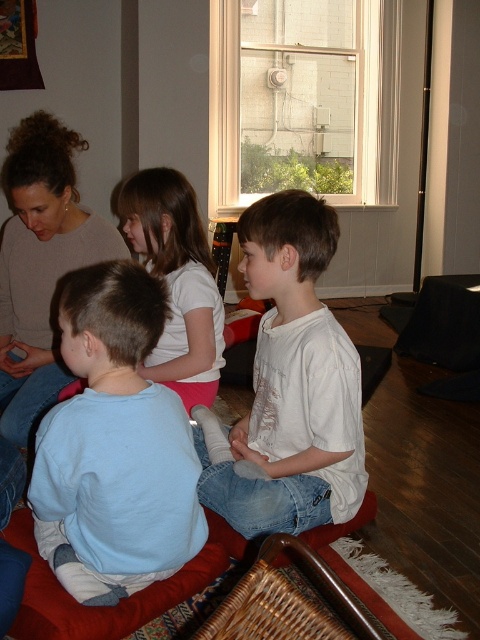
In the scene shown: You are a parent trying to ensure all children are within a safe distance of each other for a group activity. The children are positioned at point (204, 529). What is the minimum distance you should set for the safety zone to include all children?

The minimum distance for the safety zone should be at least 1.64 meters to include all children positioned at point (204, 529).

You are a photographer trying to capture a group photo of the children. You notice two children wearing white shirts at the center of the scene. To ensure both are visible, should you position the child in the white cotton shirt at center to the right or left of the white matte shirt at center?

The white cotton shirt at center is already positioned to the right of the white matte shirt at center, so you should keep the white cotton shirt at center to the right of the white matte shirt at center to ensure both are visible.

You are a photographer trying to capture a clear shot of both the white cotton shirt at center and the white matte shirt at center. Since they are both in the center, which one is easier to focus on?

The white cotton shirt at center is closer to the viewer than the white matte shirt at center, so it is easier to focus on.